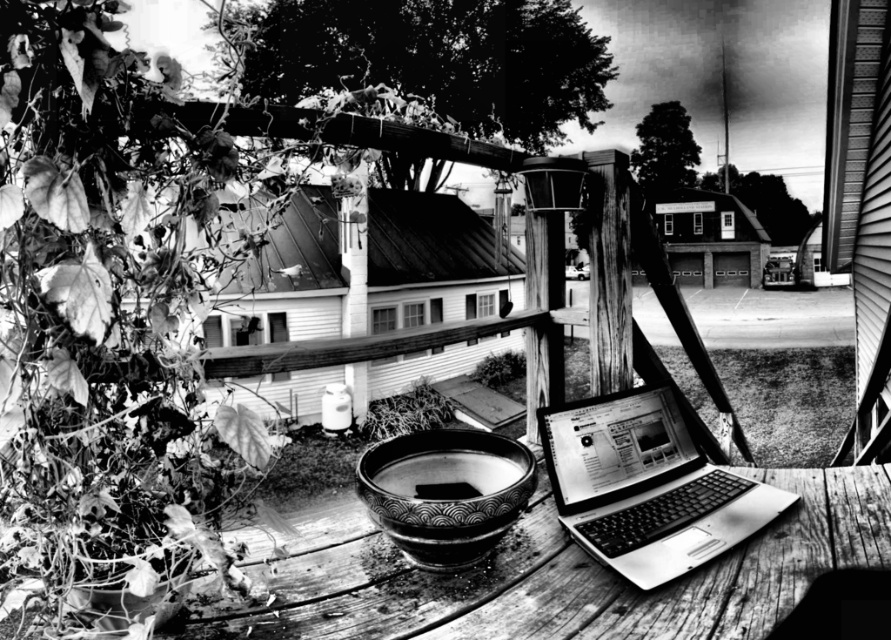
You are a photographer trying to capture the metallic silver laptop at center in your shot. The camera you are using has a fixed focal length lens and a sensor size of 24mm x 36mm. If you want to ensure the laptop is centered in the frame and occupies exactly 20 percent of the frame height, what is the minimum distance you should be from the laptop?

To calculate the minimum distance required, we can use the formula for sensor height and desired subject height. The sensor height is 24mm. 20 percent of this is 4.8mm. Using the formula distance equals sensor dimension divided by twice the tangent of half the angle of view, but since focal length and angle of view are fixed, we can rearrange to solve for distance. However, without knowing the exact focal length, we can estimate using similar triangles. If the laptop height on the sensor is 4.8mm and the 24

You are a delivery robot with a package that is 12 inches wide. You need to place it on the table between the metallic silver laptop at center and the patterned ceramic bowl at center. Is there enough space between them to fit your package?

The distance between the metallic silver laptop at center and the patterned ceramic bowl at center is 11.77 inches. Since the package is 12 inches wide, it is slightly wider than the available space, so the package cannot fit between them.